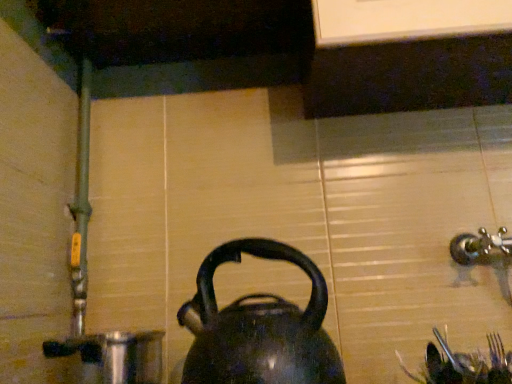
The image size is (512, 384). What do you see at coordinates (258, 327) in the screenshot? I see `shiny black kettle at center` at bounding box center [258, 327].

In order to click on shiny black kettle at center in this screenshot , I will do click(x=258, y=327).

This screenshot has height=384, width=512. I want to click on shiny metallic pot at lower left, so click(115, 355).

The height and width of the screenshot is (384, 512). Describe the element at coordinates (115, 355) in the screenshot. I see `shiny metallic pot at lower left` at that location.

Where is `shiny black kettle at center`? shiny black kettle at center is located at coordinates (258, 327).

Which is more to the right, shiny black kettle at center or shiny metallic pot at lower left?

From the viewer's perspective, shiny black kettle at center appears more on the right side.

In the image, is shiny black kettle at center positioned in front of or behind shiny metallic pot at lower left?

shiny black kettle at center is positioned closer to the viewer than shiny metallic pot at lower left.

Which is further, (265, 379) or (65, 348)?

The point (65, 348) is behind.

From the image's perspective, which is above, shiny black kettle at center or shiny metallic pot at lower left?

shiny black kettle at center is shown above in the image.

From a real-world perspective, between shiny black kettle at center and shiny metallic pot at lower left, who is vertically higher?

From a 3D spatial view, shiny black kettle at center is above.

Considering the relative sizes of shiny black kettle at center and shiny metallic pot at lower left in the image provided, is shiny black kettle at center thinner than shiny metallic pot at lower left?

Yes, shiny black kettle at center is thinner than shiny metallic pot at lower left.

Does shiny black kettle at center have a lesser height compared to shiny metallic pot at lower left?

Incorrect, the height of shiny black kettle at center does not fall short of that of shiny metallic pot at lower left.

Is shiny black kettle at center smaller than shiny metallic pot at lower left?

Yes.

Would you say shiny black kettle at center contains shiny metallic pot at lower left?

That's incorrect, shiny metallic pot at lower left is not inside shiny black kettle at center.

Would you consider shiny black kettle at center to be distant from shiny metallic pot at lower left?

No, there isn't a large distance between shiny black kettle at center and shiny metallic pot at lower left.

Is shiny black kettle at center looking in the opposite direction of shiny metallic pot at lower left?

No, shiny black kettle at center is not facing the opposite direction of shiny metallic pot at lower left.

How different are the orientations of shiny black kettle at center and shiny metallic pot at lower left in degrees?

The angle between the facing direction of shiny black kettle at center and the facing direction of shiny metallic pot at lower left is 2.46 degrees.

At what (x,y) coordinates should I click in order to perform the action: click on kettle that is above the shiny metallic pot at lower left (from a real-world perspective). Please return your answer as a coordinate pair (x, y). The image size is (512, 384). Looking at the image, I should click on (258, 327).

Can you confirm if shiny metallic pot at lower left is positioned to the right of shiny black kettle at center?

No.

Which object is closer to the camera taking this photo, shiny metallic pot at lower left or shiny black kettle at center?

shiny black kettle at center.

Which is farther, (68,345) or (242,310)?

Point (68,345)

From the image's perspective, relative to shiny black kettle at center, is shiny metallic pot at lower left above or below?

From the image's perspective, shiny metallic pot at lower left appears below shiny black kettle at center.

From a real-world perspective, is shiny metallic pot at lower left below shiny black kettle at center?

Yes, from a real-world perspective, shiny metallic pot at lower left is beneath shiny black kettle at center.

Considering the relative sizes of shiny metallic pot at lower left and shiny black kettle at center in the image provided, is shiny metallic pot at lower left thinner than shiny black kettle at center?

In fact, shiny metallic pot at lower left might be wider than shiny black kettle at center.

Considering the sizes of objects shiny metallic pot at lower left and shiny black kettle at center in the image provided, who is taller, shiny metallic pot at lower left or shiny black kettle at center?

With more height is shiny black kettle at center.

Who is smaller, shiny metallic pot at lower left or shiny black kettle at center?

shiny black kettle at center.

Would you say shiny metallic pot at lower left contains shiny black kettle at center?

No.

Is shiny metallic pot at lower left in contact with shiny black kettle at center?

There is a gap between shiny metallic pot at lower left and shiny black kettle at center.

Consider the image. Could you tell me if shiny metallic pot at lower left is turned towards shiny black kettle at center?

No, shiny metallic pot at lower left is not facing towards shiny black kettle at center.

Consider the image. How far apart are shiny metallic pot at lower left and shiny black kettle at center?

shiny metallic pot at lower left and shiny black kettle at center are 10.66 inches apart from each other.

Locate an element on the screen. This screenshot has width=512, height=384. coffeepot that appears behind the shiny black kettle at center is located at coordinates (115, 355).

Where is `coffeepot lying below the shiny black kettle at center (from the image's perspective)`? The height and width of the screenshot is (384, 512). coffeepot lying below the shiny black kettle at center (from the image's perspective) is located at coordinates (115, 355).

You are a GUI agent. You are given a task and a screenshot of the screen. Output one action in this format:
    pyautogui.click(x=<x>, y=<y>)
    Task: Click on the kettle positioned vertically above the shiny metallic pot at lower left (from a real-world perspective)
    
    Given the screenshot: What is the action you would take?
    pyautogui.click(x=258, y=327)